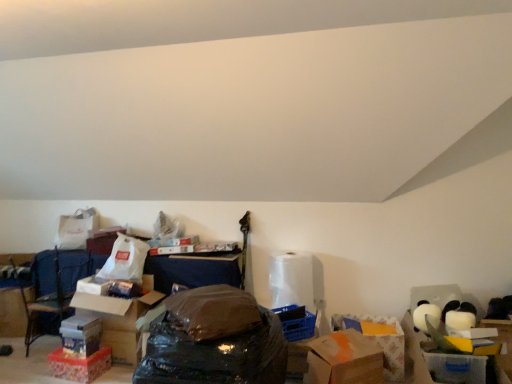
Question: From a real-world perspective, is blue fabric armchair at lower left located higher than translucent plastic storage box at lower left, positioned as the second storage box in back-to-front order?

Choices:
 (A) yes
 (B) no

Answer: (A)

Question: Is blue fabric armchair at lower left facing away from translucent plastic storage box at lower left, which is the 2th storage box from front to back?

Choices:
 (A) yes
 (B) no

Answer: (B)

Question: Does blue fabric armchair at lower left come behind translucent plastic storage box at lower left, which ranks as the third storage box in right-to-left order?

Choices:
 (A) yes
 (B) no

Answer: (A)

Question: Could you tell me if blue fabric armchair at lower left is facing translucent plastic storage box at lower left, marked as the first storage box in a left-to-right arrangement?

Choices:
 (A) no
 (B) yes

Answer: (A)

Question: Considering the relative sizes of blue fabric armchair at lower left and translucent plastic storage box at lower left, which is the 2th storage box from front to back, in the image provided, is blue fabric armchair at lower left wider than translucent plastic storage box at lower left, which is the 2th storage box from front to back,?

Choices:
 (A) yes
 (B) no

Answer: (A)

Question: Considering the relative positions of blue fabric armchair at lower left and translucent plastic storage box at lower left, marked as the first storage box in a left-to-right arrangement, in the image provided, is blue fabric armchair at lower left in front of translucent plastic storage box at lower left, marked as the first storage box in a left-to-right arrangement,?

Choices:
 (A) no
 (B) yes

Answer: (A)

Question: Is translucent plastic storage box at lower left, which ranks as the third storage box in right-to-left order, at the left side of blue fabric armchair at lower left?

Choices:
 (A) yes
 (B) no

Answer: (B)

Question: Does translucent plastic storage box at lower left, which ranks as the third storage box in right-to-left order, touch blue fabric armchair at lower left?

Choices:
 (A) yes
 (B) no

Answer: (B)

Question: Can you confirm if translucent plastic storage box at lower left, marked as the first storage box in a left-to-right arrangement, is smaller than blue fabric armchair at lower left?

Choices:
 (A) yes
 (B) no

Answer: (A)

Question: Is translucent plastic storage box at lower left, which is the 2th storage box from front to back, wider than blue fabric armchair at lower left?

Choices:
 (A) no
 (B) yes

Answer: (A)

Question: Does translucent plastic storage box at lower left, positioned as the second storage box in back-to-front order, have a larger size compared to blue fabric armchair at lower left?

Choices:
 (A) yes
 (B) no

Answer: (B)

Question: From the image's perspective, would you say translucent plastic storage box at lower left, positioned as the second storage box in back-to-front order, is shown under blue fabric armchair at lower left?

Choices:
 (A) yes
 (B) no

Answer: (A)

Question: Is matte cardboard box at lower left, arranged as the 2th storage box when viewed from the right, with orange matte cardboard box at center, which is the first cardboard box from right to left?

Choices:
 (A) yes
 (B) no

Answer: (B)